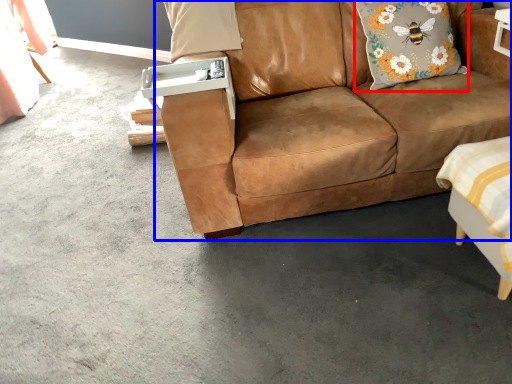
Question: Which object appears closest to the camera in this image, pillow (highlighted by a red box) or studio couch (highlighted by a blue box)?

Choices:
 (A) pillow
 (B) studio couch

Answer: (B)